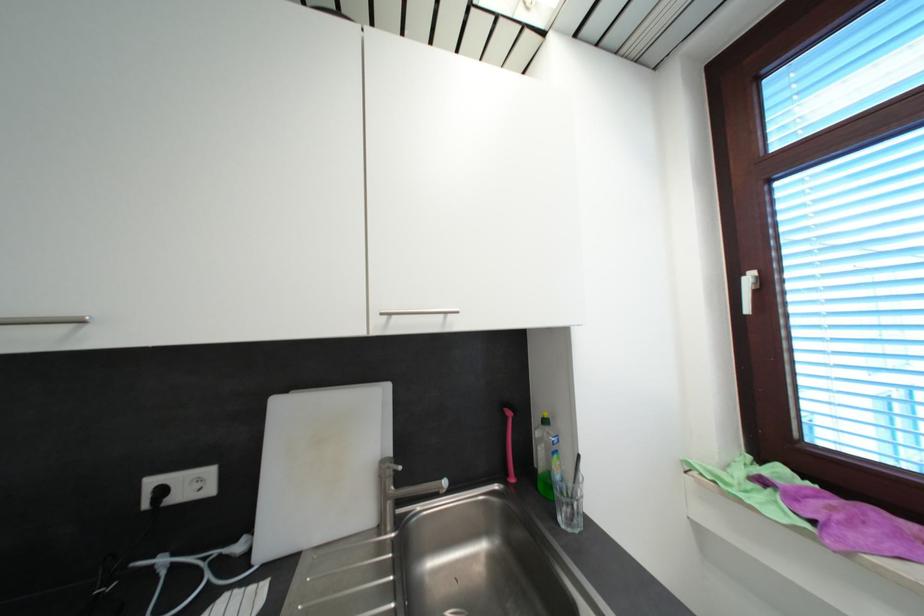
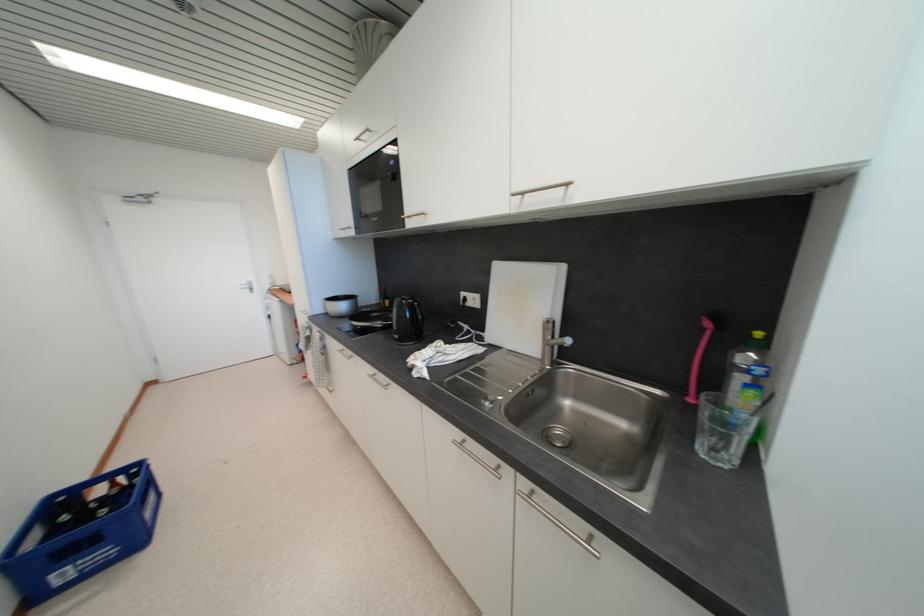
The point at (561,459) is marked in the first image. Where is the corresponding point in the second image?

(757, 394)